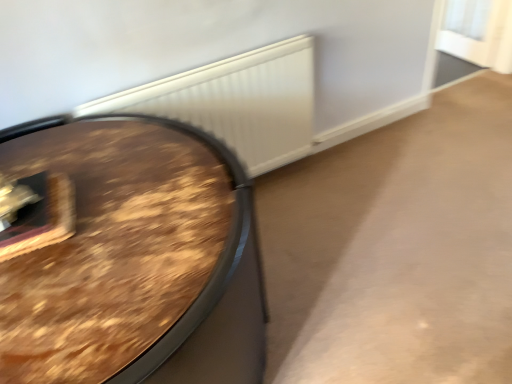
Locate an element on the screen. The height and width of the screenshot is (384, 512). free point below white textured radiator at center (from a real-world perspective) is located at coordinates (279, 180).